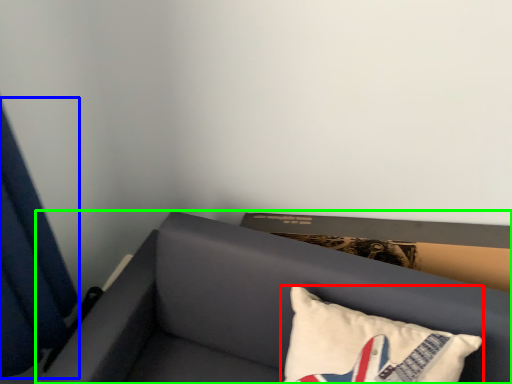
Question: Based on their relative distances, which object is farther from pillow (highlighted by a red box)? Choose from curtain (highlighted by a blue box) and furniture (highlighted by a green box).

Choices:
 (A) curtain
 (B) furniture

Answer: (A)